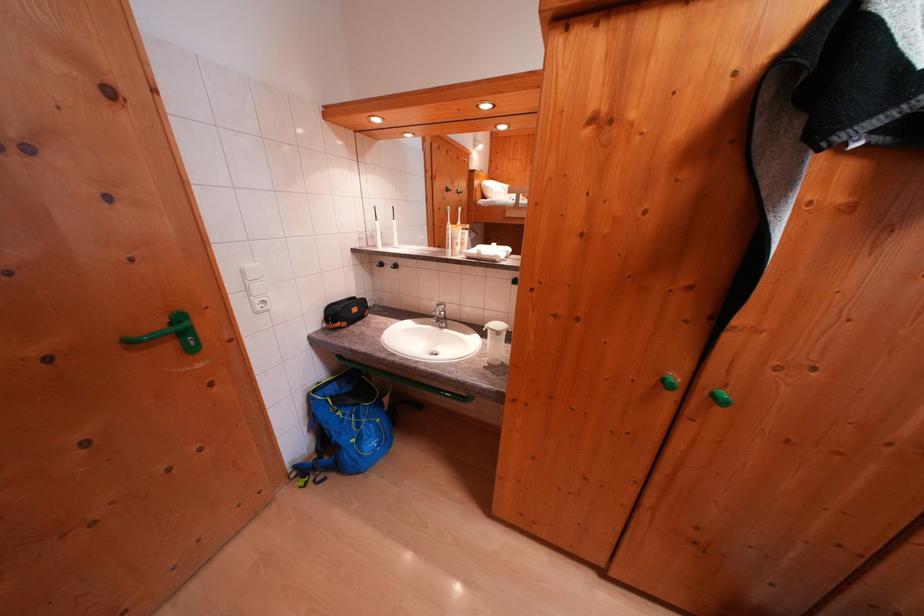
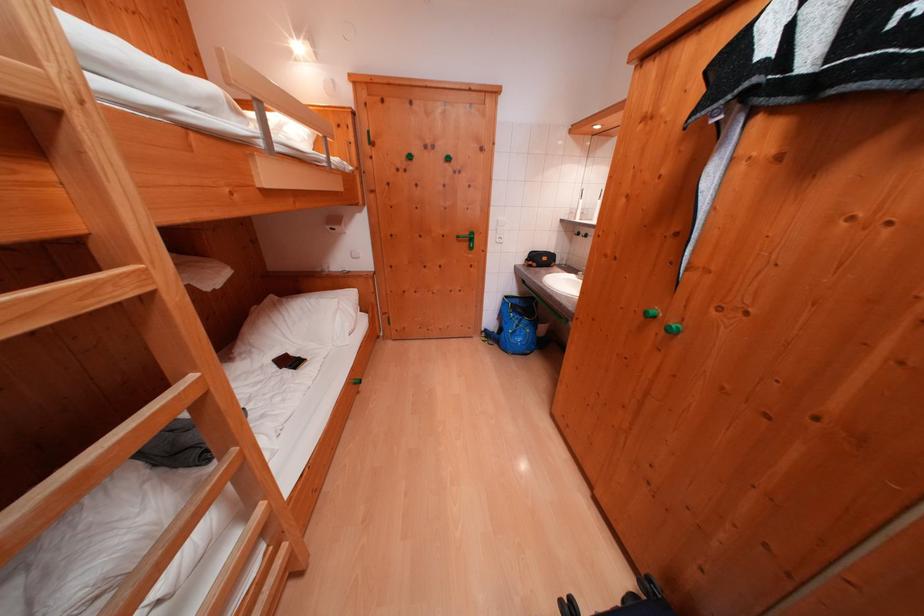
The point at [140,347] is marked in the first image. Where is the corresponding point in the second image?

(466, 241)